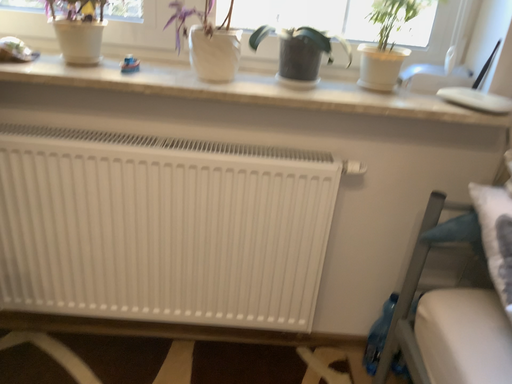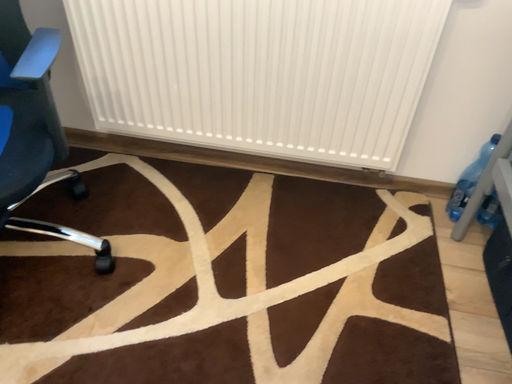
Question: Which way did the camera rotate in the video?

Choices:
 (A) rotated left
 (B) rotated right

Answer: (A)